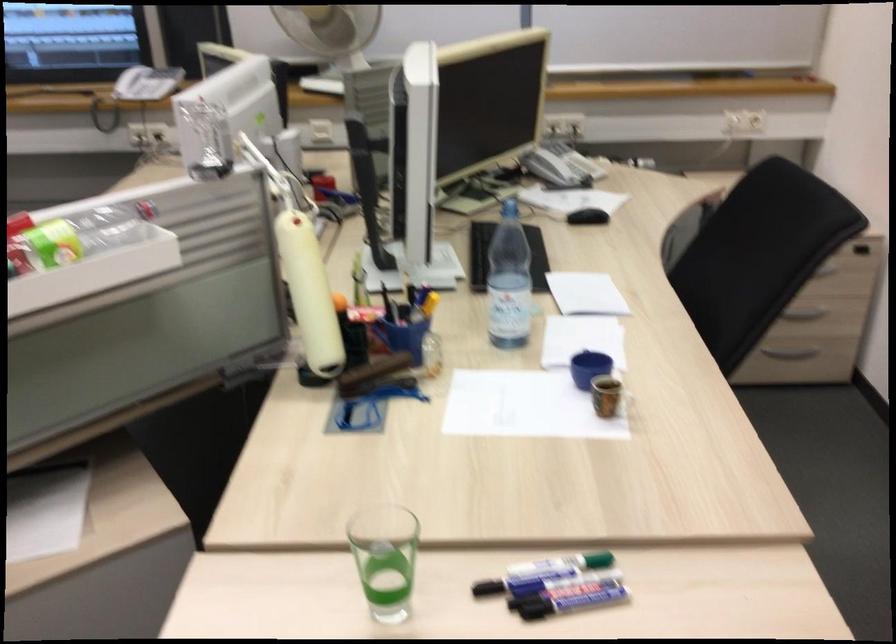
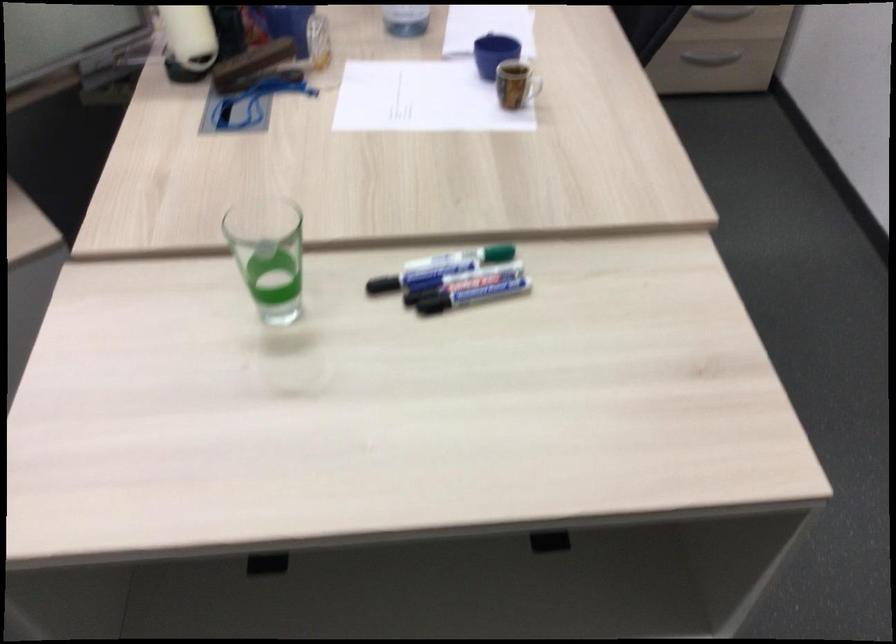
Locate, in the second image, the point that corresponds to the point at 629,398 in the first image.

(531, 88)